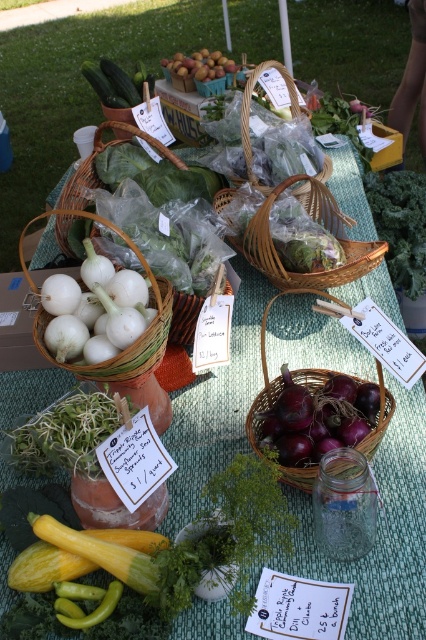
Can you confirm if green leafy kale at upper right is positioned above green matte pepper at lower left?

Yes, green leafy kale at upper right is above green matte pepper at lower left.

Does point (368, 192) come behind point (112, 593)?

That is True.

Who is more forward, (377, 208) or (77, 618)?

Point (77, 618) is more forward.

Where is `green leafy kale at upper right`? green leafy kale at upper right is located at coordinates [x=400, y=225].

Is smooth yellow squash at center shorter than green matte pepper at lower left?

In fact, smooth yellow squash at center may be taller than green matte pepper at lower left.

The height and width of the screenshot is (640, 426). Identify the location of smooth yellow squash at center. (199, 65).

Which is in front, point (218, 51) or point (88, 621)?

Point (88, 621)

The width and height of the screenshot is (426, 640). I want to click on smooth yellow squash at center, so click(x=199, y=65).

Is woven brown basket at center to the left of white woven basket at left from the viewer's perspective?

No, woven brown basket at center is not to the left of white woven basket at left.

Can you confirm if woven brown basket at center is positioned above white woven basket at left?

Yes.

Is point (336, 285) closer to viewer compared to point (46, 358)?

That is False.

Locate an element on the screen. The height and width of the screenshot is (640, 426). woven brown basket at center is located at coordinates (319, 224).